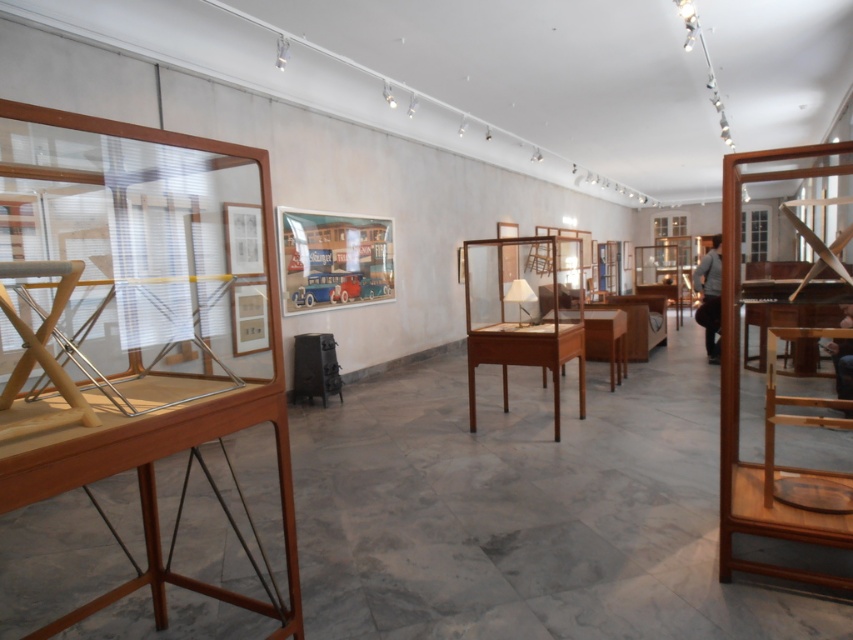
You are a visitor in the exhibition space and want to take a photo of the teak wood folding chair at right with your camera. Can you fit both the chair and the camera in a 2.5 meter wide photo frame?

The distance between the teak wood folding chair at right and the camera is 2.17 meters, which is less than the 2.5 meter width of the photo frame. Therefore, both can fit within the frame.

Looking at this image, you are standing in the center of the exhibition room and want to move towards the teak wood folding chair at right. Based on its coordinates, which direction should you move?

The teak wood folding chair at right is located at coordinates point (738, 392). Since you are at the center, you should move towards the right and slightly forward to reach it.

You are a visitor in the exhibition space and want to take a photo of the teak wood folding chair at right without the teak wood cabinet at center blocking the view. Can you stand to the left side of the display case to achieve this?

The teak wood folding chair at right is below the teak wood cabinet at center, so standing to the left side of the display case would allow you to position yourself below the cabinet and capture the chair without obstruction.